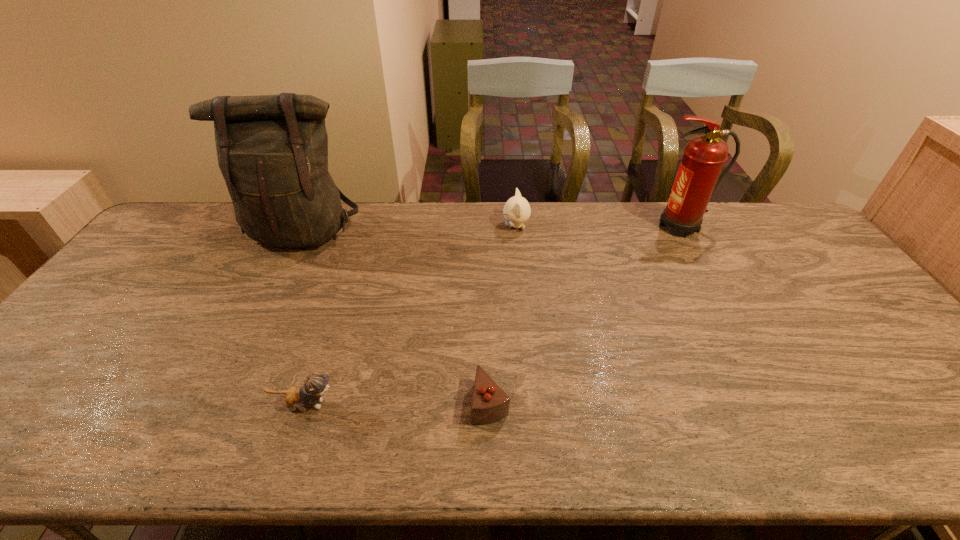
This screenshot has height=540, width=960. I want to click on vacant point located 0.280m on the front-facing side of the second tallest object, so click(x=567, y=226).

Identify the location of vacant space located on the front-facing side of the second tallest object. Image resolution: width=960 pixels, height=540 pixels. (535, 226).

I want to click on blank area located on the front-facing side of the second tallest object, so click(x=609, y=226).

Identify the location of vacant point located 0.080m on the face of the farther kitten. (479, 226).

At what (x,y) coordinates should I click in order to perform the action: click on free space located 0.350m on the face of the farther kitten. Please return your answer as a coordinate pair (x, y). The width and height of the screenshot is (960, 540). Looking at the image, I should click on (399, 226).

I want to click on vacant area situated on the face of the farther kitten, so click(x=388, y=226).

What are the coordinates of `blank space located on the front-facing side of the nearer kitten` in the screenshot? It's located at (457, 404).

This screenshot has height=540, width=960. I want to click on vacant area situated 0.120m on the right of the shortest object, so click(x=561, y=402).

At what (x,y) coordinates should I click in order to perform the action: click on backpack that is positioned at the far edge. Please return your answer as a coordinate pair (x, y). This screenshot has width=960, height=540. Looking at the image, I should click on (272, 150).

Identify the location of fire extinguisher present at the far edge. 704,156.